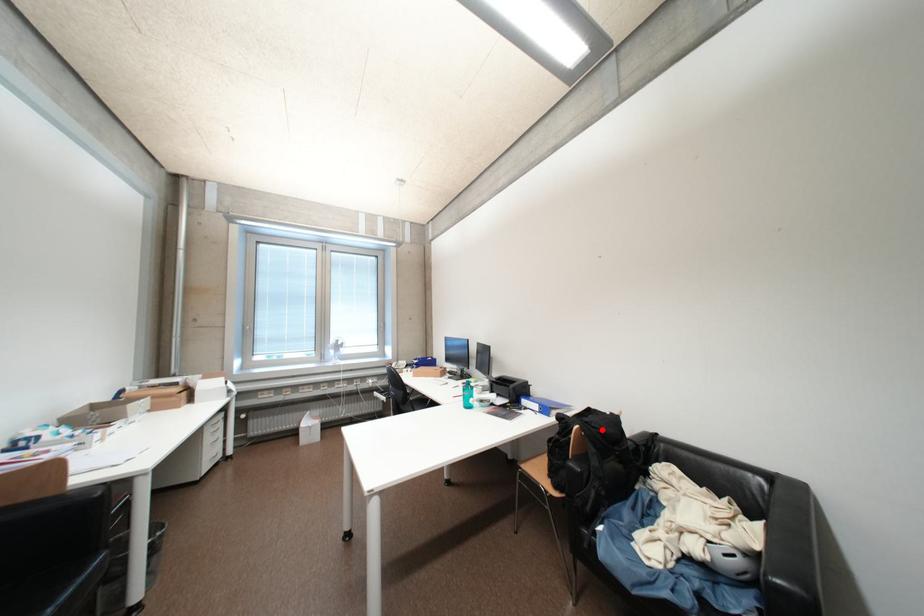
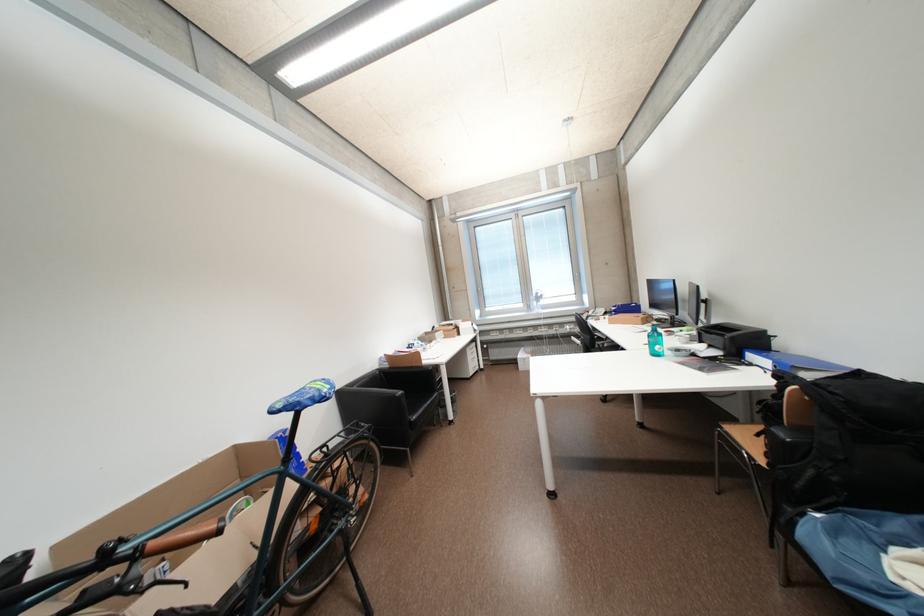
In the second image, find the point that corresponds to the highlighted location in the first image.

(841, 395)